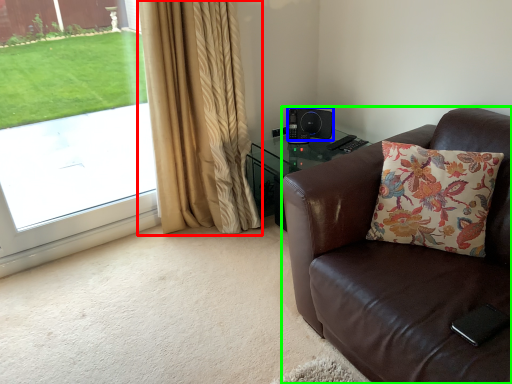
Question: Estimate the real-world distances between objects in this image. Which object is farther from curtain (highlighted by a red box), speaker (highlighted by a blue box) or chair (highlighted by a green box)?

Choices:
 (A) speaker
 (B) chair

Answer: (B)